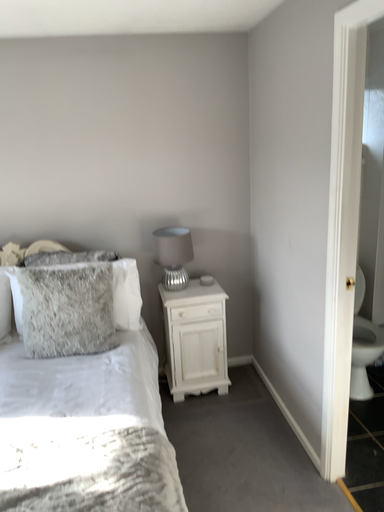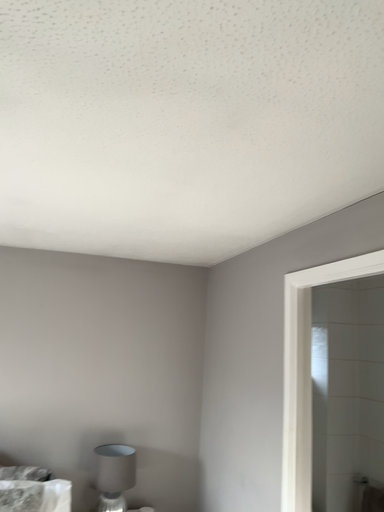
Question: How did the camera likely rotate when shooting the video?

Choices:
 (A) rotated right
 (B) rotated left

Answer: (A)